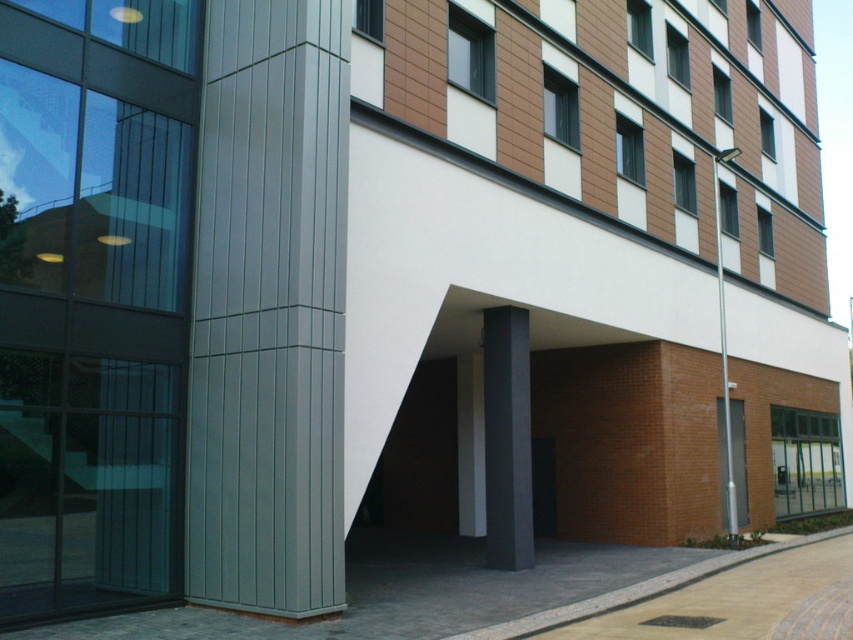
You are standing in front of the black glass door at center and want to reach the silver metallic pole at right. Which direction should you move to get there?

You should move to your right since the silver metallic pole at right is positioned on the right side of the black glass door at center.

You are standing in front of the modern architectural structure. You notice two points marked on the central column. The first point is at coordinates point [730,406] and the second is at point [547,497]. Which point is closer to your eyes?

Point [730,406] is further to the camera than point [547,497], so the point closer to your eyes is point [547,497].